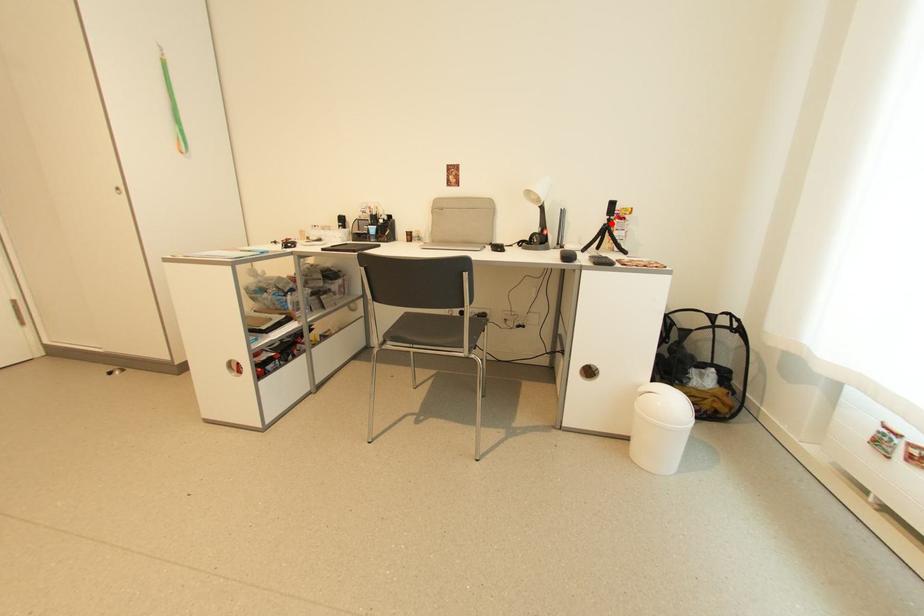
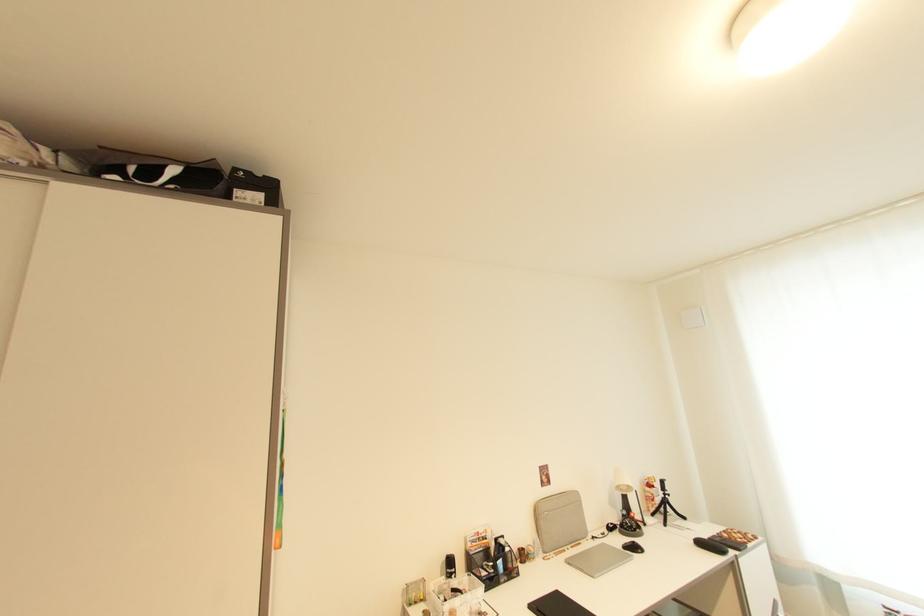
Question: A red point is marked in image1. In image2, is the corresponding 3D point closer to the camera or farther? Reply with the corresponding letter.

Choices:
 (A) The corresponding 3D point is closer.
 (B) The corresponding 3D point is farther.

Answer: (B)